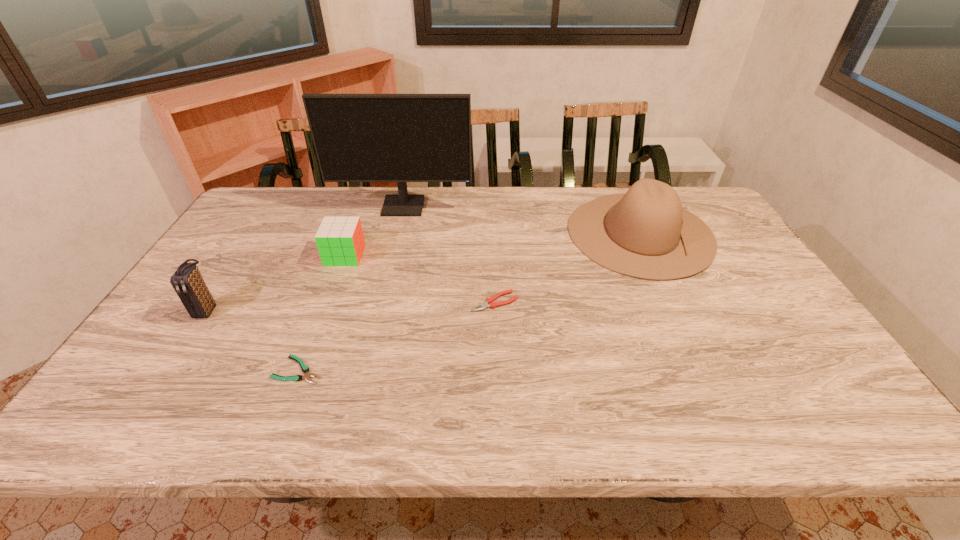
At what (x,y) coordinates should I click in order to perform the action: click on vacant area between the sombrero and the cube. Please return your answer as a coordinate pair (x, y). Looking at the image, I should click on (492, 244).

Find the location of a particular element. Image resolution: width=960 pixels, height=540 pixels. free space between the tallest object and the taller pliers is located at coordinates (449, 254).

At what (x,y) coordinates should I click in order to perform the action: click on free space between the nearer pliers and the fourth tallest object. Please return your answer as a coordinate pair (x, y). Looking at the image, I should click on (322, 313).

This screenshot has height=540, width=960. I want to click on free area in between the right pliers and the cube, so click(x=420, y=279).

I want to click on unoccupied area between the fourth tallest object and the shorter pliers, so click(322, 313).

At what (x,y) coordinates should I click in order to perform the action: click on free space that is in between the leftmost object and the rightmost object. Please return your answer as a coordinate pair (x, y). Looking at the image, I should click on (423, 272).

Find the location of `empty space between the computer monitor and the clutch bag`. empty space between the computer monitor and the clutch bag is located at coordinates (305, 259).

The width and height of the screenshot is (960, 540). What are the coordinates of `object that is the fifth nearest to the right pliers` in the screenshot? It's located at (187, 281).

This screenshot has height=540, width=960. In order to click on object that is the fourth closest to the right pliers in this screenshot , I will do click(x=401, y=138).

Identify the location of free space that satisfies the following two spatial constraints: 1. on the front-facing side of the tallest object; 2. on the right side of the taller pliers. (380, 302).